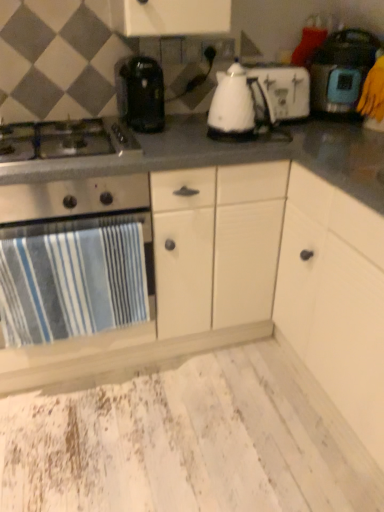
The height and width of the screenshot is (512, 384). Describe the element at coordinates (64, 140) in the screenshot. I see `stainless steel gas stove at left` at that location.

From the picture: Measure the distance between point (53, 145) and camera.

Point (53, 145) and camera are 1.34 meters apart.

This screenshot has height=512, width=384. What are the coordinates of `blue striped towel at left, the 1th kitchen appliance positioned from the left` in the screenshot? It's located at (77, 200).

Is gray matte countertop at center taller than matte black rice cooker at right, marked as the third kitchen appliance in a left-to-right arrangement?

Yes.

From a real-world perspective, is gray matte countertop at center located beneath matte black rice cooker at right, marked as the third kitchen appliance in a left-to-right arrangement?

Yes, from a real-world perspective, gray matte countertop at center is below matte black rice cooker at right, marked as the third kitchen appliance in a left-to-right arrangement.

Measure the distance from gray matte countertop at center to matte black rice cooker at right, the 1th kitchen appliance in the right-to-left sequence.

gray matte countertop at center is 25.99 inches away from matte black rice cooker at right, the 1th kitchen appliance in the right-to-left sequence.

From the image's perspective, is gray matte countertop at center under matte black rice cooker at right, marked as the third kitchen appliance in a left-to-right arrangement?

Correct, gray matte countertop at center appears lower than matte black rice cooker at right, marked as the third kitchen appliance in a left-to-right arrangement, in the image.

Based on the photo, which object is positioned more to the right, gray matte countertop at center or white plastic toaster at center, which is the 2th kitchen appliance in left-to-right order?

Positioned to the right is white plastic toaster at center, which is the 2th kitchen appliance in left-to-right order.

Which of these two, gray matte countertop at center or white plastic toaster at center, which is the 2th kitchen appliance in left-to-right order, is wider?

gray matte countertop at center is wider.

Between blue striped towel at left, arranged as the 3th kitchen appliance when viewed from the right, and white plastic toaster at center, which is the 2th kitchen appliance in left-to-right order, which one has larger width?

blue striped towel at left, arranged as the 3th kitchen appliance when viewed from the right, is wider.

Is point (53, 208) positioned before point (248, 117)?

That is True.

Considering the sizes of blue striped towel at left, arranged as the 3th kitchen appliance when viewed from the right, and white plastic toaster at center, which is the 2th kitchen appliance in left-to-right order, in the image, is blue striped towel at left, arranged as the 3th kitchen appliance when viewed from the right, taller or shorter than white plastic toaster at center, which is the 2th kitchen appliance in left-to-right order,?

In the image, blue striped towel at left, arranged as the 3th kitchen appliance when viewed from the right, appears to be taller than white plastic toaster at center, which is the 2th kitchen appliance in left-to-right order.

From a real-world perspective, which is physically below, blue striped towel at left, arranged as the 3th kitchen appliance when viewed from the right, or white plastic toaster at center, which is the 2th kitchen appliance in left-to-right order?

blue striped towel at left, arranged as the 3th kitchen appliance when viewed from the right, is physically lower.

In order to click on kitchen appliance above the white plastic toaster at center, arranged as the 2th kitchen appliance when viewed from the right (from a real-world perspective) in this screenshot , I will do `click(341, 70)`.

Which is closer, (353,106) or (215,93)?

Point (353,106)

Does matte black rice cooker at right, the 1th kitchen appliance in the right-to-left sequence, appear on the right side of white plastic toaster at center, which is the 2th kitchen appliance in left-to-right order?

Yes.

Is the surface of matte black rice cooker at right, marked as the third kitchen appliance in a left-to-right arrangement, in direct contact with white plastic toaster at center, arranged as the 2th kitchen appliance when viewed from the right?

No, matte black rice cooker at right, marked as the third kitchen appliance in a left-to-right arrangement, is not with white plastic toaster at center, arranged as the 2th kitchen appliance when viewed from the right.

From a real-world perspective, is stainless steel gas stove at left above or below gray matte countertop at center?

stainless steel gas stove at left is situated higher than gray matte countertop at center in the real world.

Is stainless steel gas stove at left aimed at gray matte countertop at center?

Yes.

Is stainless steel gas stove at left shorter than gray matte countertop at center?

Correct, stainless steel gas stove at left is not as tall as gray matte countertop at center.

From the image's perspective, relative to stainless steel gas stove at left, is white plastic toaster at center, arranged as the 2th kitchen appliance when viewed from the right, above or below?

From the image's perspective, white plastic toaster at center, arranged as the 2th kitchen appliance when viewed from the right, appears above stainless steel gas stove at left.

Can you confirm if white plastic toaster at center, which is the 2th kitchen appliance in left-to-right order, is taller than stainless steel gas stove at left?

Yes.

From a real-world perspective, is white plastic toaster at center, arranged as the 2th kitchen appliance when viewed from the right, positioned under stainless steel gas stove at left based on gravity?

No, from a real-world perspective, white plastic toaster at center, arranged as the 2th kitchen appliance when viewed from the right, is not beneath stainless steel gas stove at left.

Would you say white plastic toaster at center, which is the 2th kitchen appliance in left-to-right order, is to the left or to the right of matte black rice cooker at right, marked as the third kitchen appliance in a left-to-right arrangement, in the picture?

Clearly, white plastic toaster at center, which is the 2th kitchen appliance in left-to-right order, is on the left of matte black rice cooker at right, marked as the third kitchen appliance in a left-to-right arrangement, in the image.

Image resolution: width=384 pixels, height=512 pixels. Identify the location of kitchen appliance that appears above the white plastic toaster at center, arranged as the 2th kitchen appliance when viewed from the right (from a real-world perspective). (341, 70).

Does point (226, 72) come farther from viewer compared to point (316, 92)?

No.

Image resolution: width=384 pixels, height=512 pixels. I want to click on the 3rd kitchen appliance located above the gray matte countertop at center (from a real-world perspective), so click(341, 70).

Where is `countertop in front of the white plastic toaster at center, arranged as the 2th kitchen appliance when viewed from the right`? Image resolution: width=384 pixels, height=512 pixels. countertop in front of the white plastic toaster at center, arranged as the 2th kitchen appliance when viewed from the right is located at coordinates (256, 262).

Based on their spatial positions, is blue striped towel at left, the 1th kitchen appliance positioned from the left, or stainless steel gas stove at left further from gray matte countertop at center?

stainless steel gas stove at left lies further to gray matte countertop at center than the other object.

Which object lies nearer to the anchor point matte black rice cooker at right, the 1th kitchen appliance in the right-to-left sequence, white plastic toaster at center, arranged as the 2th kitchen appliance when viewed from the right, or blue striped towel at left, the 1th kitchen appliance positioned from the left?

The object closer to matte black rice cooker at right, the 1th kitchen appliance in the right-to-left sequence, is white plastic toaster at center, arranged as the 2th kitchen appliance when viewed from the right.

Based on their spatial positions, is white plastic toaster at center, arranged as the 2th kitchen appliance when viewed from the right, or stainless steel gas stove at left further from matte black rice cooker at right, marked as the third kitchen appliance in a left-to-right arrangement?

The object further to matte black rice cooker at right, marked as the third kitchen appliance in a left-to-right arrangement, is stainless steel gas stove at left.

Consider the image. Which object lies further to the anchor point matte black rice cooker at right, marked as the third kitchen appliance in a left-to-right arrangement, gray matte countertop at center or white plastic toaster at center, which is the 2th kitchen appliance in left-to-right order?

The object further to matte black rice cooker at right, marked as the third kitchen appliance in a left-to-right arrangement, is gray matte countertop at center.

Looking at the image, which one is located further to stainless steel gas stove at left, matte black rice cooker at right, the 1th kitchen appliance in the right-to-left sequence, or blue striped towel at left, the 1th kitchen appliance positioned from the left?

matte black rice cooker at right, the 1th kitchen appliance in the right-to-left sequence, is further to stainless steel gas stove at left.

When comparing their distances from stainless steel gas stove at left, does matte black rice cooker at right, the 1th kitchen appliance in the right-to-left sequence, or white plastic toaster at center, arranged as the 2th kitchen appliance when viewed from the right, seem closer?

Based on the image, white plastic toaster at center, arranged as the 2th kitchen appliance when viewed from the right, appears to be nearer to stainless steel gas stove at left.

Consider the image. Looking at the image, which one is located closer to stainless steel gas stove at left, white plastic toaster at center, arranged as the 2th kitchen appliance when viewed from the right, or matte black rice cooker at right, marked as the third kitchen appliance in a left-to-right arrangement?

The object closer to stainless steel gas stove at left is white plastic toaster at center, arranged as the 2th kitchen appliance when viewed from the right.

Looking at the image, which one is located further to blue striped towel at left, arranged as the 3th kitchen appliance when viewed from the right, gray matte countertop at center or stainless steel gas stove at left?

gray matte countertop at center is further to blue striped towel at left, arranged as the 3th kitchen appliance when viewed from the right.

Identify the location of gas stove between blue striped towel at left, the 1th kitchen appliance positioned from the left, and gray matte countertop at center. The width and height of the screenshot is (384, 512). (64, 140).

You are a GUI agent. You are given a task and a screenshot of the screen. Output one action in this format:
    pyautogui.click(x=<x>, y=<y>)
    Task: Click on the countertop between blue striped towel at left, arranged as the 3th kitchen appliance when viewed from the right, and white plastic toaster at center, arranged as the 2th kitchen appliance when viewed from the right, from left to right
    The width and height of the screenshot is (384, 512).
    Given the screenshot: What is the action you would take?
    pyautogui.click(x=256, y=262)

Locate an element on the screen. kitchen appliance between stainless steel gas stove at left and matte black rice cooker at right, marked as the third kitchen appliance in a left-to-right arrangement is located at coordinates (258, 98).

What are the coordinates of `gas stove situated between blue striped towel at left, arranged as the 3th kitchen appliance when viewed from the right, and white plastic toaster at center, which is the 2th kitchen appliance in left-to-right order, from left to right` in the screenshot? It's located at (64, 140).